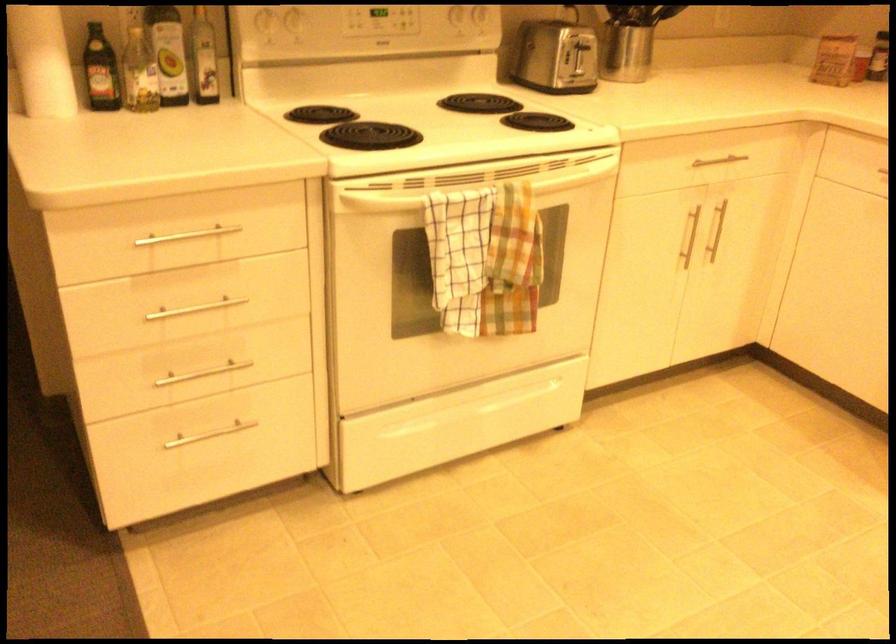
Find where to pull the white oven handle. Please return your answer as a coordinate pair (x, y).

(374, 202)